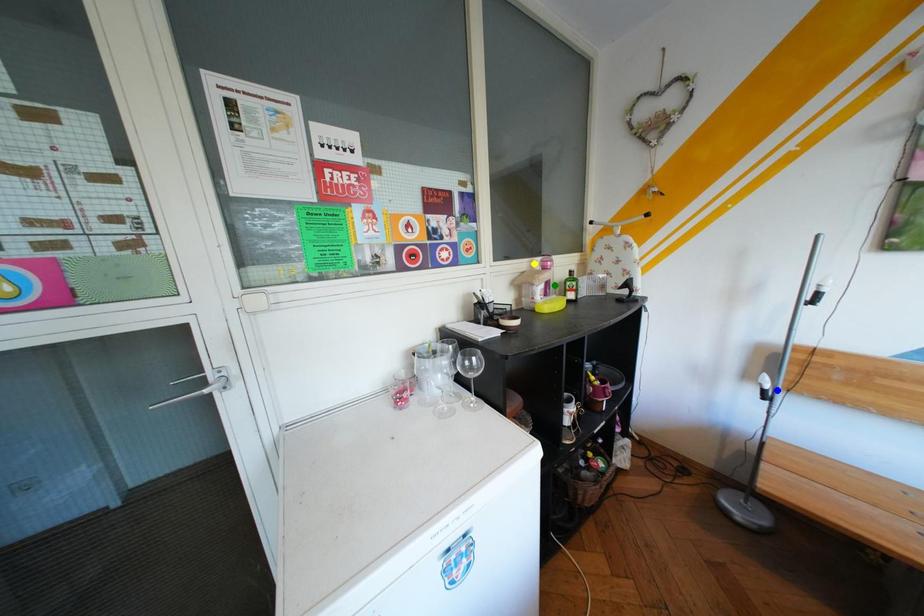
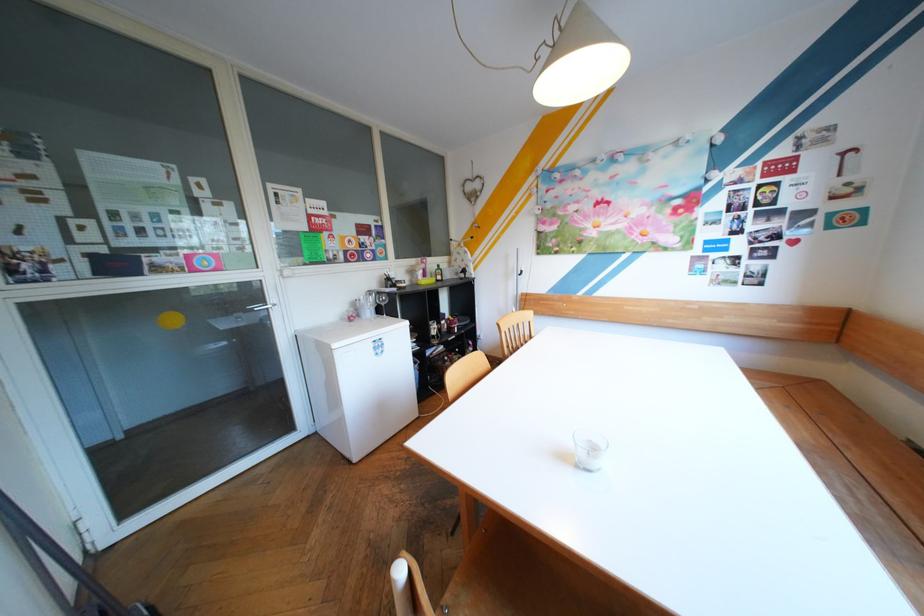
I am providing you with two images of the same scene from different viewpoints. Three points are marked in image1. Which point corresponds to a part or object that is occluded in image2?In image1, three points are marked. Which of them correspond to a part or object that is occluded in image2?Among the three points shown in image1, which one corresponds to a part or object that is no longer visible due to occlusion in image2?

blue point cannot be seen in image2.